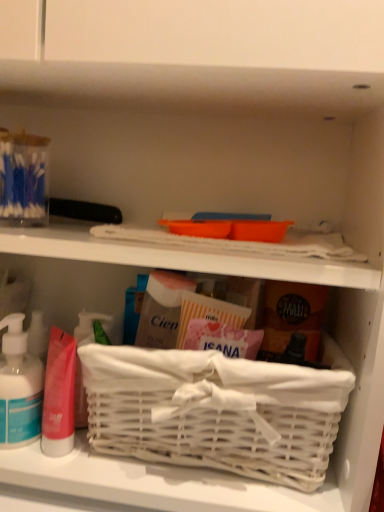
Measure the distance between point (262, 397) and camera.

Point (262, 397) is 16.38 inches away from camera.

The image size is (384, 512). Identify the location of white wicker basket at center. (217, 410).

Describe the element at coordinates (217, 410) in the screenshot. The width and height of the screenshot is (384, 512). I see `white wicker basket at center` at that location.

I want to click on translucent plastic pump bottle at lower left, so click(x=19, y=386).

What is the approximate width of translucent plastic pump bottle at lower left?

3.31 inches.

Image resolution: width=384 pixels, height=512 pixels. Describe the element at coordinates (19, 386) in the screenshot. I see `translucent plastic pump bottle at lower left` at that location.

Locate an element on the screen. white wicker basket at center is located at coordinates (217, 410).

Which object is positioned more to the right, white wicker basket at center or translucent plastic pump bottle at lower left?

From the viewer's perspective, white wicker basket at center appears more on the right side.

Is the depth of white wicker basket at center greater than that of translucent plastic pump bottle at lower left?

No.

Between point (206, 428) and point (29, 383), which one is positioned in front?

The point (206, 428) is closer.

From the image's perspective, is white wicker basket at center positioned above or below translucent plastic pump bottle at lower left?

white wicker basket at center is below translucent plastic pump bottle at lower left.

From a real-world perspective, which is physically below, white wicker basket at center or translucent plastic pump bottle at lower left?

white wicker basket at center.

Considering the relative sizes of white wicker basket at center and translucent plastic pump bottle at lower left in the image provided, is white wicker basket at center wider than translucent plastic pump bottle at lower left?

Indeed, white wicker basket at center has a greater width compared to translucent plastic pump bottle at lower left.

Between white wicker basket at center and translucent plastic pump bottle at lower left, which one has less height?

translucent plastic pump bottle at lower left is shorter.

Between white wicker basket at center and translucent plastic pump bottle at lower left, which one has larger size?

Bigger between the two is white wicker basket at center.

Is white wicker basket at center situated inside translucent plastic pump bottle at lower left or outside?

white wicker basket at center cannot be found inside translucent plastic pump bottle at lower left.

Are white wicker basket at center and translucent plastic pump bottle at lower left beside each other?

No, white wicker basket at center is not in contact with translucent plastic pump bottle at lower left.

Is white wicker basket at center positioned with its back to translucent plastic pump bottle at lower left?

No, white wicker basket at center's orientation is not away from translucent plastic pump bottle at lower left.

How distant is white wicker basket at center from translucent plastic pump bottle at lower left?

6.91 inches.

Find the location of a particular element. basket container on the right of translucent plastic pump bottle at lower left is located at coordinates (217, 410).

In the scene shown: Would you say translucent plastic pump bottle at lower left is to the left or to the right of white wicker basket at center in the picture?

Based on their positions, translucent plastic pump bottle at lower left is located to the left of white wicker basket at center.

In the image, is translucent plastic pump bottle at lower left positioned in front of or behind white wicker basket at center?

translucent plastic pump bottle at lower left is positioned farther from the viewer than white wicker basket at center.

Which is in front, point (1, 426) or point (218, 450)?

The point (218, 450) is more forward.

In the scene shown: From the image's perspective, is translucent plastic pump bottle at lower left on top of white wicker basket at center?

Correct, translucent plastic pump bottle at lower left appears higher than white wicker basket at center in the image.

From a real-world perspective, which is physically below, translucent plastic pump bottle at lower left or white wicker basket at center?

white wicker basket at center.

Considering the relative sizes of translucent plastic pump bottle at lower left and white wicker basket at center in the image provided, is translucent plastic pump bottle at lower left wider than white wicker basket at center?

Incorrect, the width of translucent plastic pump bottle at lower left does not surpass that of white wicker basket at center.

Can you confirm if translucent plastic pump bottle at lower left is shorter than white wicker basket at center?

Yes.

Between translucent plastic pump bottle at lower left and white wicker basket at center, which one has larger size?

Bigger between the two is white wicker basket at center.

Would you say translucent plastic pump bottle at lower left is outside white wicker basket at center?

Yes.

Is translucent plastic pump bottle at lower left positioned far away from white wicker basket at center?

translucent plastic pump bottle at lower left is near white wicker basket at center, not far away.

Is translucent plastic pump bottle at lower left turned away from white wicker basket at center?

translucent plastic pump bottle at lower left does not have its back to white wicker basket at center.

Measure the distance between translucent plastic pump bottle at lower left and white wicker basket at center.

6.91 inches.

Where is `basket container that is on the right side of translucent plastic pump bottle at lower left`? This screenshot has height=512, width=384. basket container that is on the right side of translucent plastic pump bottle at lower left is located at coordinates (217, 410).

In the image, there is a translucent plastic pump bottle at lower left. Find the location of `basket container below it (from the image's perspective)`. basket container below it (from the image's perspective) is located at coordinates (217, 410).

Locate an element on the screen. cleaning product behind the white wicker basket at center is located at coordinates (19, 386).